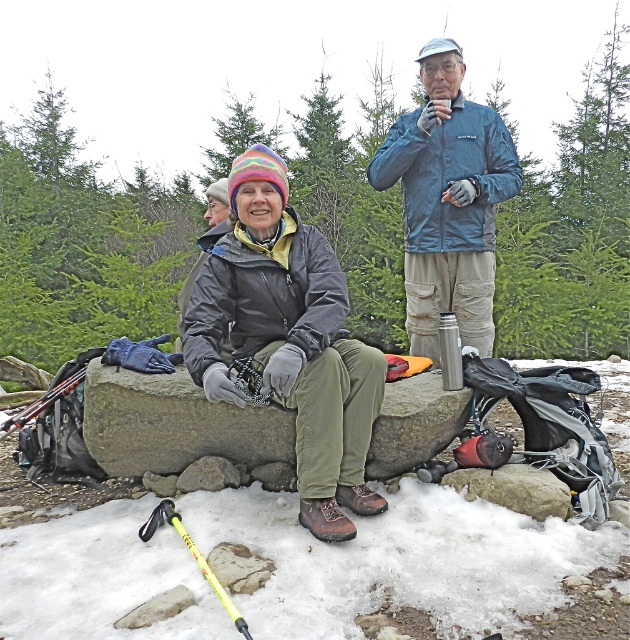
Is matte black jacket at center thinner than blue textured jacket at upper center?

Indeed, matte black jacket at center has a lesser width compared to blue textured jacket at upper center.

Does matte black jacket at center appear under blue textured jacket at upper center?

Yes.

The height and width of the screenshot is (640, 630). In order to click on matte black jacket at center in this screenshot , I will do `click(289, 340)`.

Where is `matte black jacket at center`? matte black jacket at center is located at coordinates (289, 340).

Find the location of a particular element. blue textured jacket at upper center is located at coordinates (447, 202).

Is point (425, 88) positioned in front of point (185, 378)?

No, it is behind (185, 378).

Is point (421, 317) more distant than point (117, 412)?

Yes, point (421, 317) is behind point (117, 412).

In order to click on blue textured jacket at upper center in this screenshot , I will do `click(447, 202)`.

Does point (425, 115) lie in front of point (450, 417)?

No, it is not.

Who is lower down, matte black jacket at center or gray stone boulder at center?

Positioned lower is gray stone boulder at center.

Find the location of a particular element. This screenshot has width=630, height=640. matte black jacket at center is located at coordinates (289, 340).